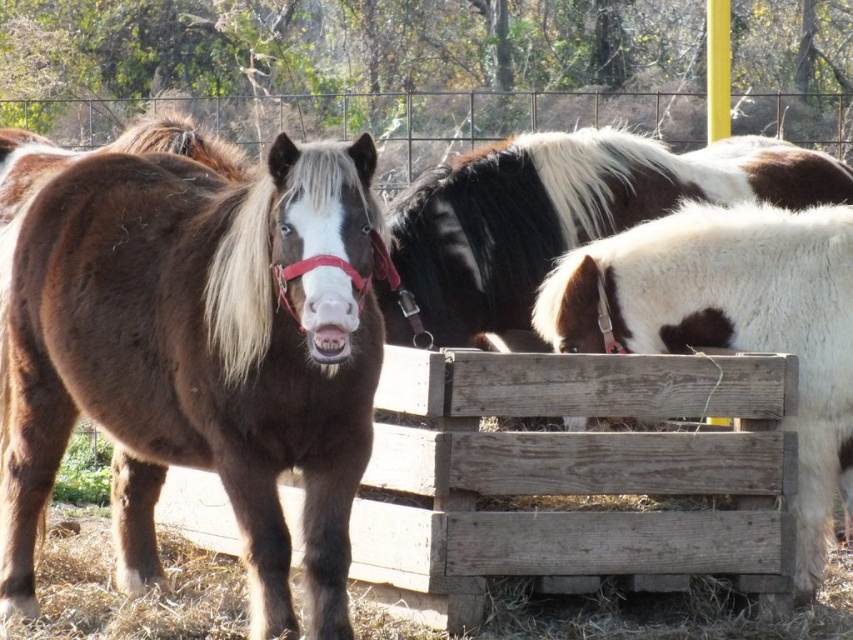
You are standing in the pasture and see the brown shaggy pony at center. There is a point at coordinates (194,353). Is this point located on the brown shaggy pony at center?

Yes, the point at coordinates (194,353) is located on the brown shaggy pony at center.

You are standing at the center of the pasture and see the point at coordinates (194, 353). What is located at that point?

The point at coordinates (194, 353) corresponds to the brown shaggy pony at center.